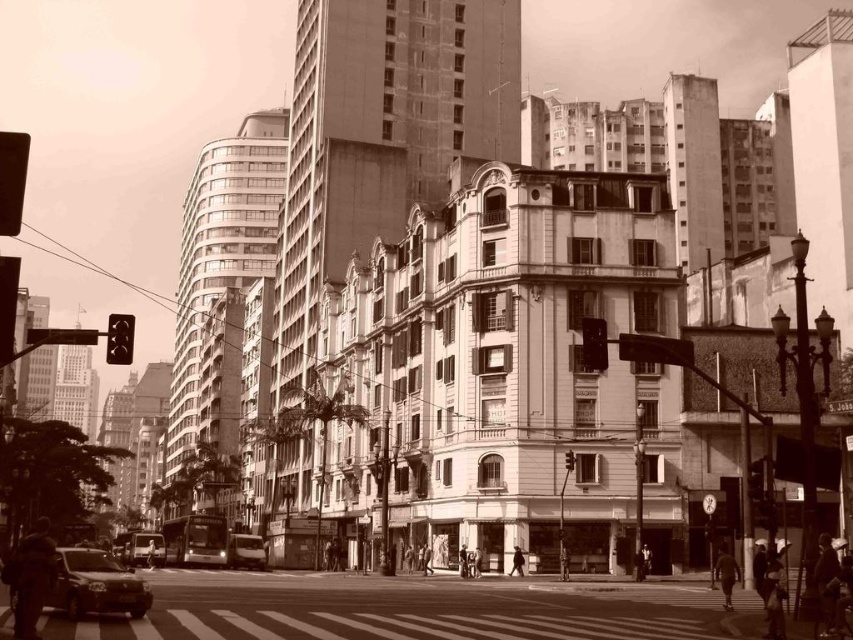
Question: Is metallic traffic light at upper center wider than metallic traffic light at center?

Choices:
 (A) no
 (B) yes

Answer: (B)

Question: Estimate the real-world distances between objects in this image. Which object is farther from the shiny silver sedan at lower left?

Choices:
 (A) metallic traffic light at center
 (B) shiny silver bus at center
 (C) black plastic traffic light at upper right
 (D) black glass traffic light at upper left

Answer: (A)

Question: Which point is closer to the camera taking this photo?

Choices:
 (A) (573, 468)
 (B) (605, 332)
 (C) (622, 340)

Answer: (B)

Question: Is black plastic traffic light at upper right to the left of shiny silver bus at center from the viewer's perspective?

Choices:
 (A) yes
 (B) no

Answer: (B)

Question: Which object is the farthest from the metallic traffic light at upper center?

Choices:
 (A) black glass traffic light at upper left
 (B) metallic traffic light at center
 (C) black plastic traffic light at upper right
 (D) shiny silver sedan at lower left

Answer: (A)

Question: Is shiny silver sedan at lower left to the left of metallic traffic light at center from the viewer's perspective?

Choices:
 (A) yes
 (B) no

Answer: (A)